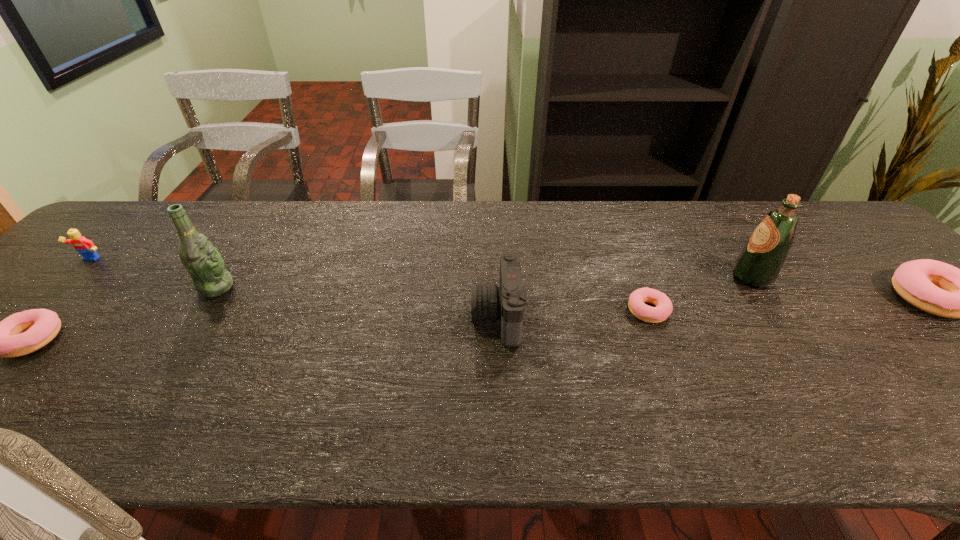
Please point a space for a new doughnut to maintain equal intervals. Please provide its 2D coordinates. Your answer should be formatted as a tuple, i.e. [(x, y)], where the tuple contains the x and y coordinates of a point satisfying the conditions above.

[(350, 325)]